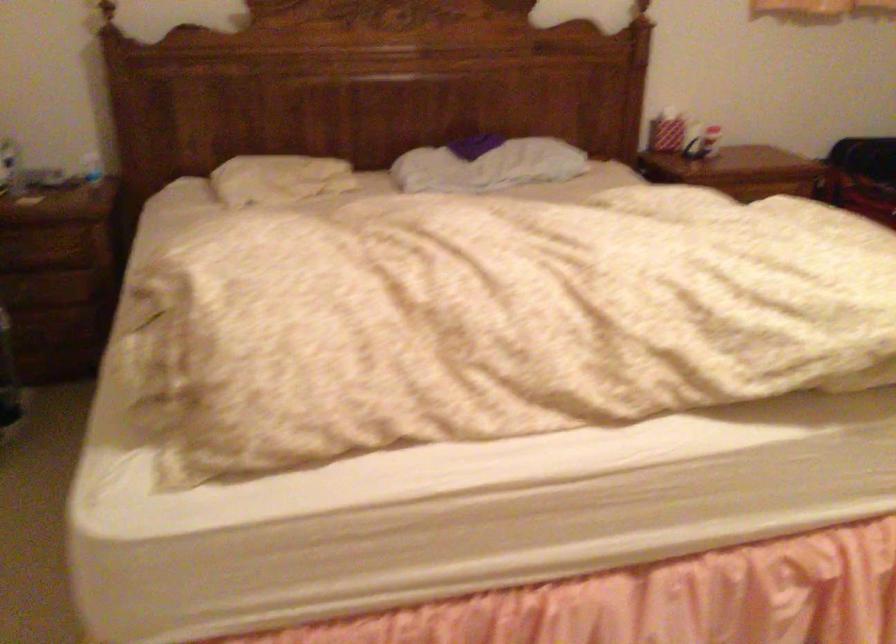
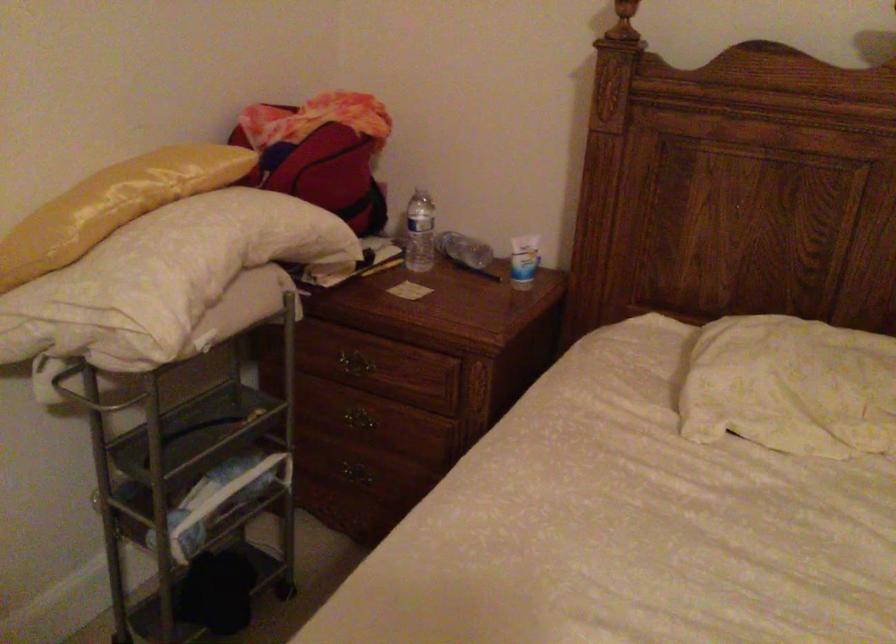
In the second image, find the point that corresponds to (97,167) in the first image.

(523, 261)